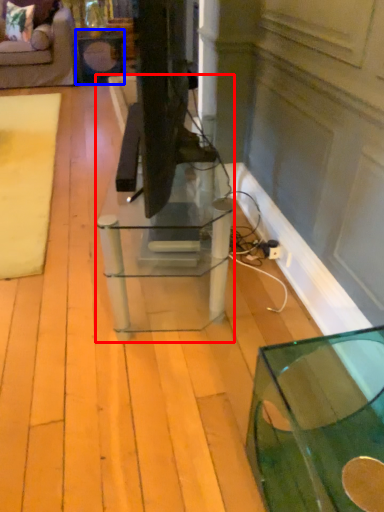
Question: Which object is further to the camera taking this photo, table (highlighted by a red box) or side table (highlighted by a blue box)?

Choices:
 (A) table
 (B) side table

Answer: (B)